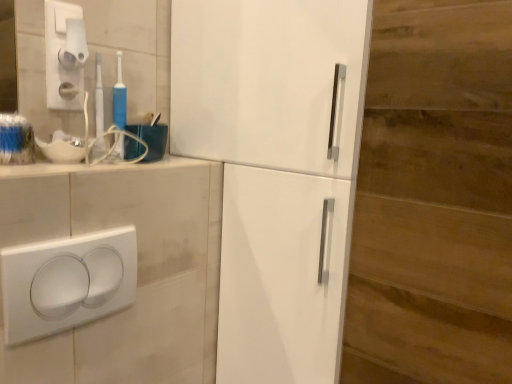
Question: Is blue plastic toothbrush at upper left, the second toothbrush from the left, wider than white plastic toothbrush at upper left, arranged as the 2th toothbrush when viewed from the right?

Choices:
 (A) yes
 (B) no

Answer: (A)

Question: From the image's perspective, does blue plastic toothbrush at upper left, the 1th toothbrush from the right, appear higher than white plastic toothbrush at upper left, arranged as the 2th toothbrush when viewed from the right?

Choices:
 (A) yes
 (B) no

Answer: (A)

Question: Is blue plastic toothbrush at upper left, the 1th toothbrush from the right, next to white plastic toothbrush at upper left, arranged as the 2th toothbrush when viewed from the right, and touching it?

Choices:
 (A) yes
 (B) no

Answer: (A)

Question: Considering the relative positions of blue plastic toothbrush at upper left, the second toothbrush from the left, and white plastic toothbrush at upper left, arranged as the 2th toothbrush when viewed from the right, in the image provided, is blue plastic toothbrush at upper left, the second toothbrush from the left, to the left of white plastic toothbrush at upper left, arranged as the 2th toothbrush when viewed from the right, from the viewer's perspective?

Choices:
 (A) yes
 (B) no

Answer: (B)

Question: Does blue plastic toothbrush at upper left, the 1th toothbrush from the right, have a greater height compared to white plastic toothbrush at upper left, arranged as the 2th toothbrush when viewed from the right?

Choices:
 (A) no
 (B) yes

Answer: (B)

Question: Is blue plastic toothbrush at upper left, the 1th toothbrush from the right, thinner than white plastic toothbrush at upper left, arranged as the 2th toothbrush when viewed from the right?

Choices:
 (A) yes
 (B) no

Answer: (B)

Question: Considering the relative sizes of white plastic/light switch at lower left, which is counted as the first light switch, starting from the front, and white glossy cabinet at center in the image provided, is white plastic/light switch at lower left, which is counted as the first light switch, starting from the front, wider than white glossy cabinet at center?

Choices:
 (A) yes
 (B) no

Answer: (B)

Question: Could you tell me if white plastic/light switch at lower left, which ranks as the second light switch in back-to-front order, is turned towards white glossy cabinet at center?

Choices:
 (A) yes
 (B) no

Answer: (B)

Question: Can you confirm if white plastic/light switch at lower left, acting as the 1th light switch starting from the bottom, is positioned to the right of white glossy cabinet at center?

Choices:
 (A) yes
 (B) no

Answer: (B)

Question: Is white plastic/light switch at lower left, which is counted as the first light switch, starting from the front, next to white glossy cabinet at center and touching it?

Choices:
 (A) yes
 (B) no

Answer: (B)

Question: From a real-world perspective, does white plastic/light switch at lower left, acting as the 1th light switch starting from the bottom, stand above white glossy cabinet at center?

Choices:
 (A) no
 (B) yes

Answer: (A)

Question: Can you confirm if white plastic/light switch at lower left, which ranks as the second light switch in top-to-bottom order, is shorter than white glossy cabinet at center?

Choices:
 (A) yes
 (B) no

Answer: (A)

Question: Is the position of white plastic toothbrush at upper left, the 1th toothbrush viewed from the left, more distant than that of blue plastic toothbrush at upper left, the 1th toothbrush from the right?

Choices:
 (A) yes
 (B) no

Answer: (B)